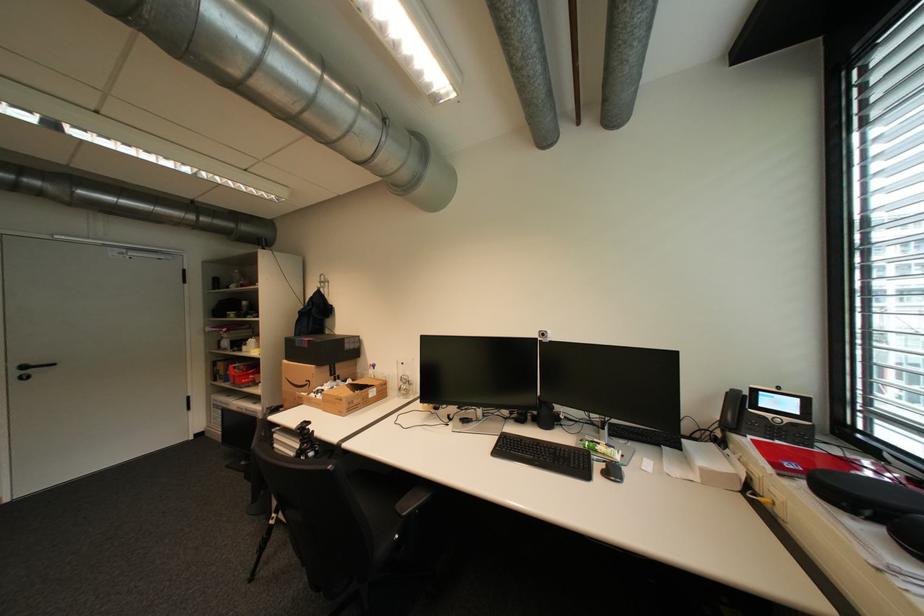
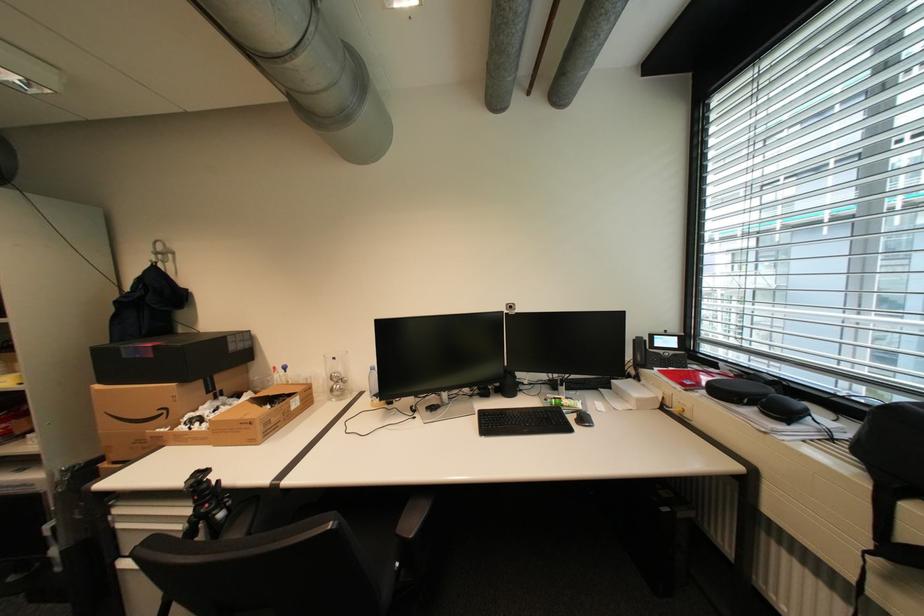
In the second image, find the point that corresponds to point (314, 347) in the first image.

(161, 357)